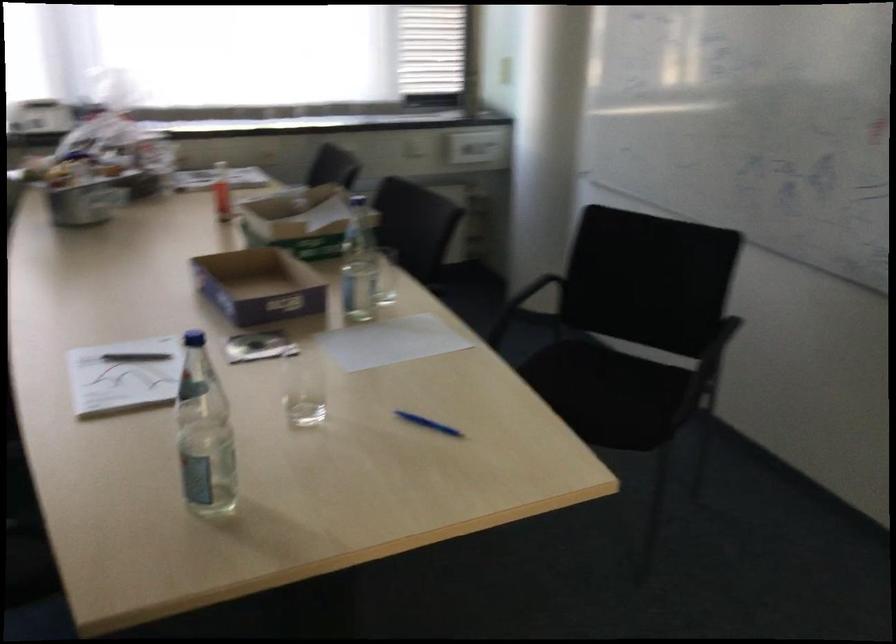
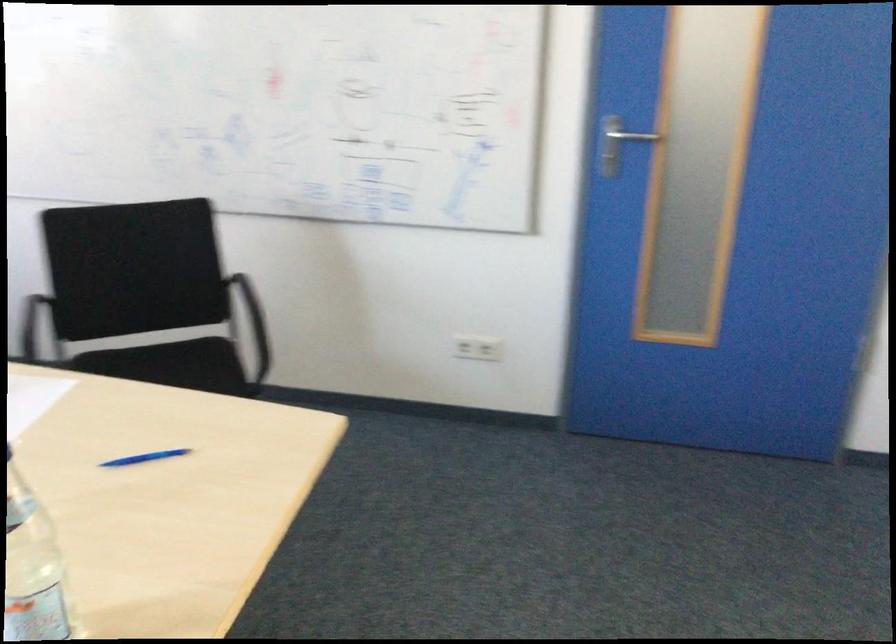
The point at (632, 383) is marked in the first image. Where is the corresponding point in the second image?

(194, 364)